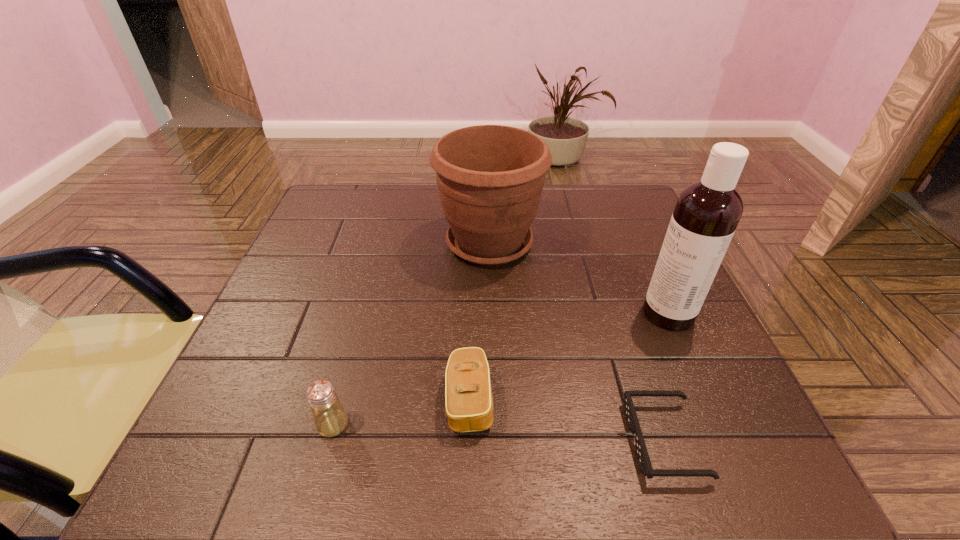
At what (x,y) coordinates should I click in order to perform the action: click on sunglasses present at the near edge. Please return your answer as a coordinate pair (x, y). Image resolution: width=960 pixels, height=540 pixels. Looking at the image, I should click on (641, 452).

You are a GUI agent. You are given a task and a screenshot of the screen. Output one action in this format:
    pyautogui.click(x=<x>, y=<y>)
    Task: Click on the dishwasher detergent positioned at the right edge
    The height and width of the screenshot is (540, 960).
    Given the screenshot: What is the action you would take?
    pyautogui.click(x=707, y=212)

Identify the location of sunglasses that is at the right edge. (641, 452).

This screenshot has height=540, width=960. I want to click on object located at the near right corner, so click(x=641, y=452).

Image resolution: width=960 pixels, height=540 pixels. Find the location of `free region at the far edge of the desktop`. free region at the far edge of the desktop is located at coordinates (534, 222).

At what (x,y) coordinates should I click in order to perform the action: click on free space at the near edge of the desktop. Please return your answer as a coordinate pair (x, y). This screenshot has height=540, width=960. Looking at the image, I should click on (605, 480).

Locate an element on the screen. This screenshot has height=540, width=960. vacant area at the left edge is located at coordinates (313, 349).

Find the location of `free spot at the right edge of the desktop`. free spot at the right edge of the desktop is located at coordinates (629, 287).

Image resolution: width=960 pixels, height=540 pixels. I want to click on vacant region at the far left corner of the desktop, so click(329, 227).

Locate an element on the screen. This screenshot has height=540, width=960. vacant region at the far right corner is located at coordinates (637, 194).